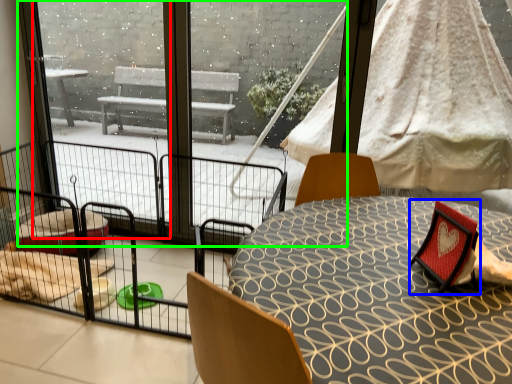
Question: Which object is the closest to the window screen (highlighted by a red box)? Choose among these: armchair (highlighted by a blue box) or glass door (highlighted by a green box).

Choices:
 (A) armchair
 (B) glass door

Answer: (B)